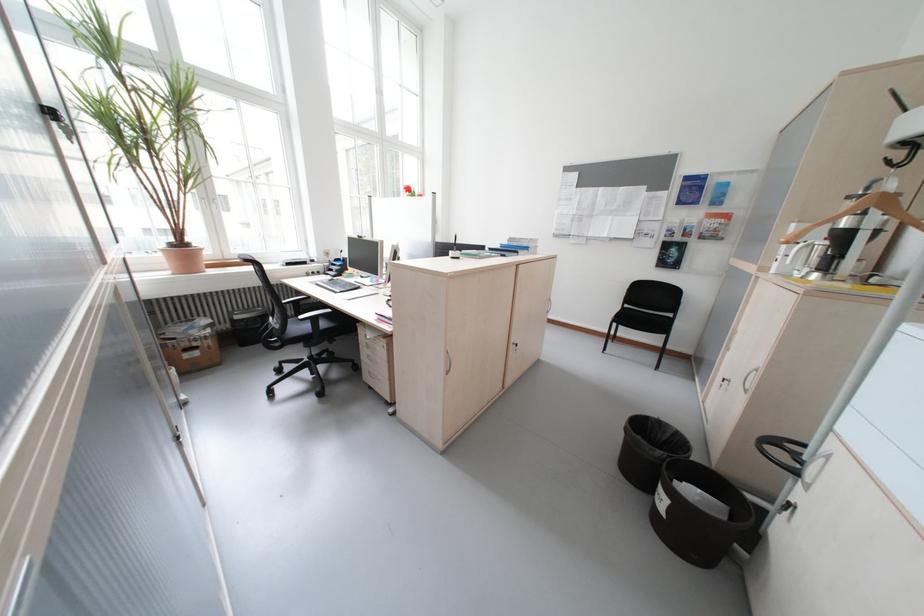
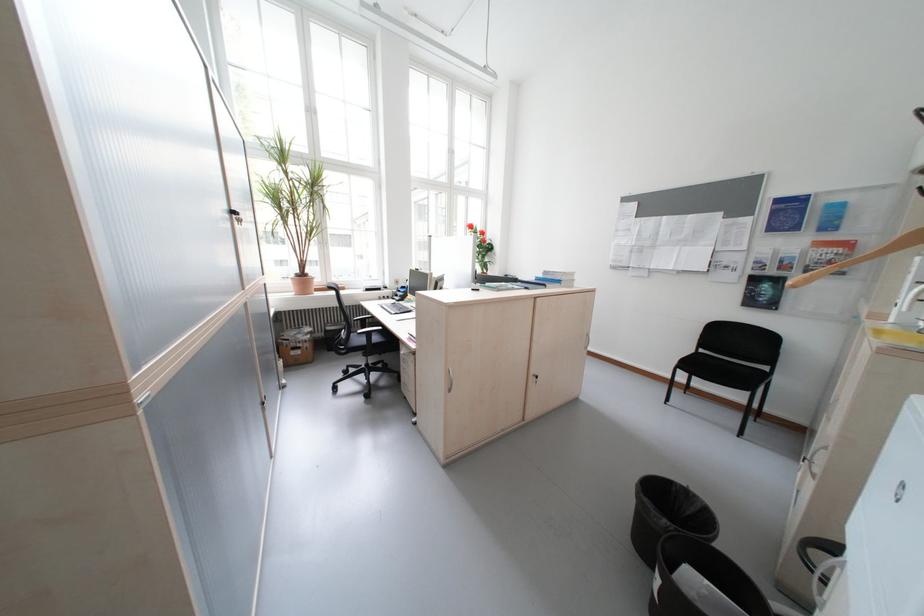
The point at (324, 321) is marked in the first image. Where is the corresponding point in the second image?

(380, 334)